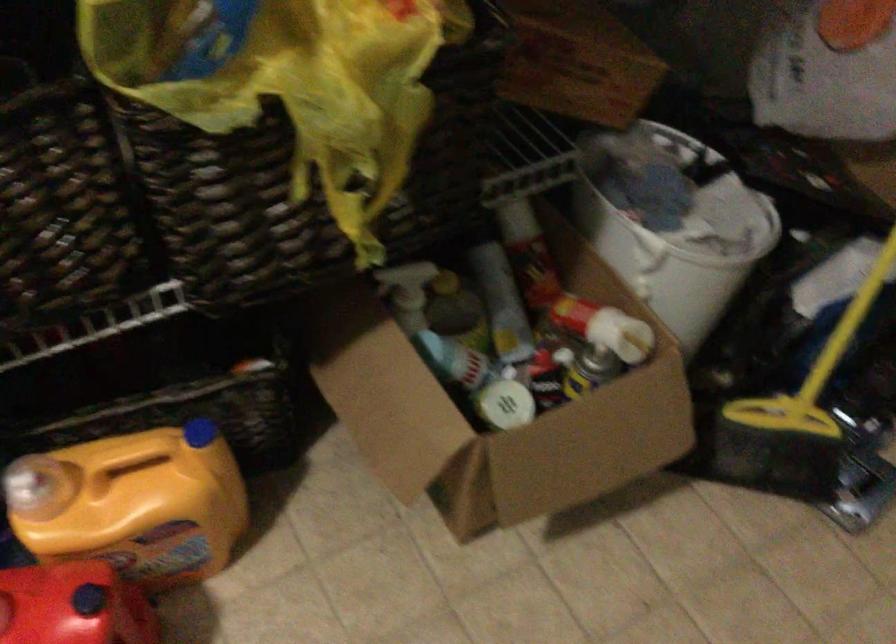
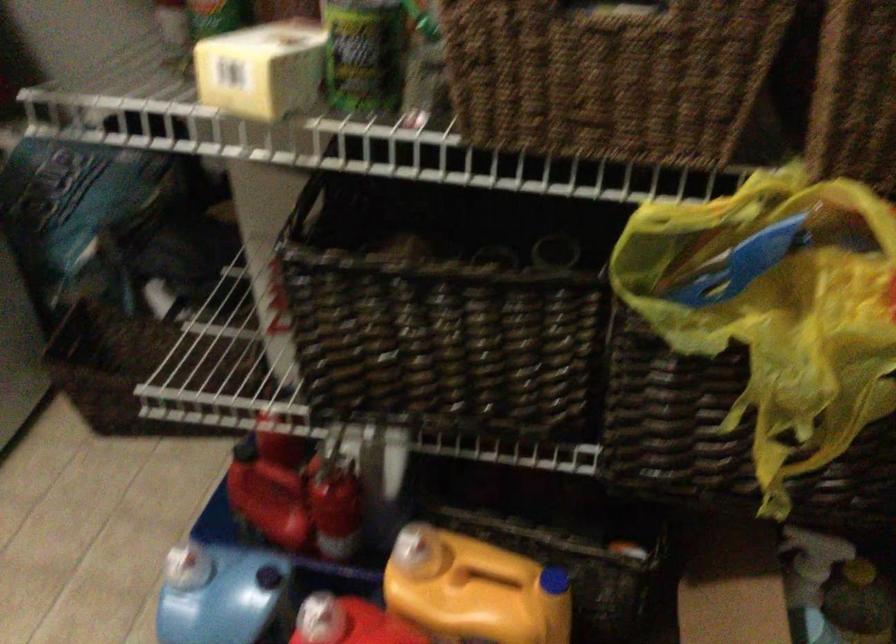
Question: How did the camera likely rotate?

Choices:
 (A) Left
 (B) Right
 (C) Up
 (D) Down

Answer: (A)